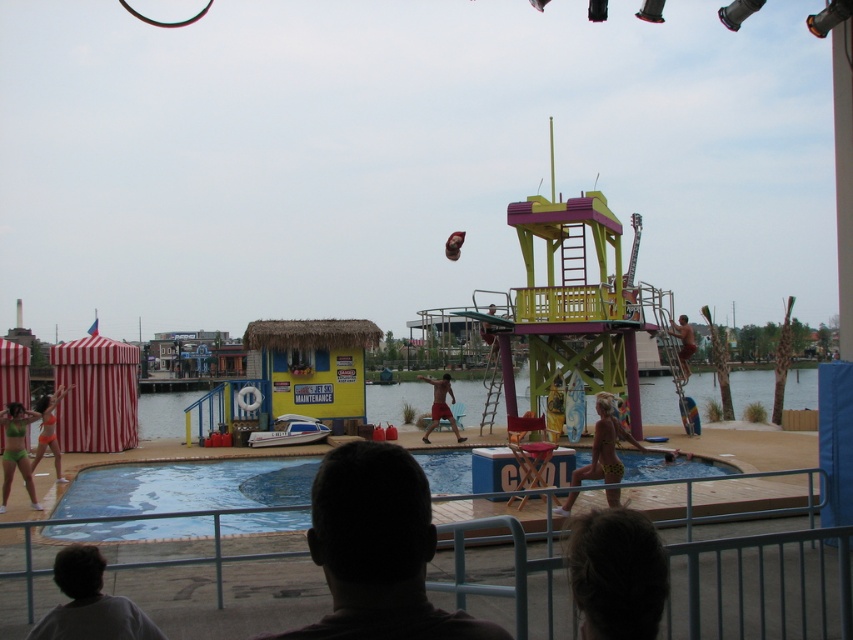
You are a lifeguard on duty at the aquatic performance area. You notice two individuals in the water, the green fabric bikini at lower left and the smooth tan skin at right. If you need to reach both of them in an emergency, which one would be closer to your current position at the lifeguard tower?

The green fabric bikini at lower left is closer to your current position at the lifeguard tower because it is only 16.97 meters away from the smooth tan skin at right, but the exact distance from the tower isn